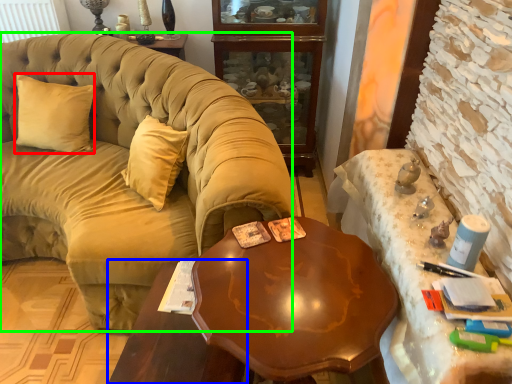
Question: Estimate the real-world distances between objects in this image. Which object is closer to pillow (highlighted by a red box), table (highlighted by a blue box) or studio couch (highlighted by a green box)?

Choices:
 (A) table
 (B) studio couch

Answer: (B)